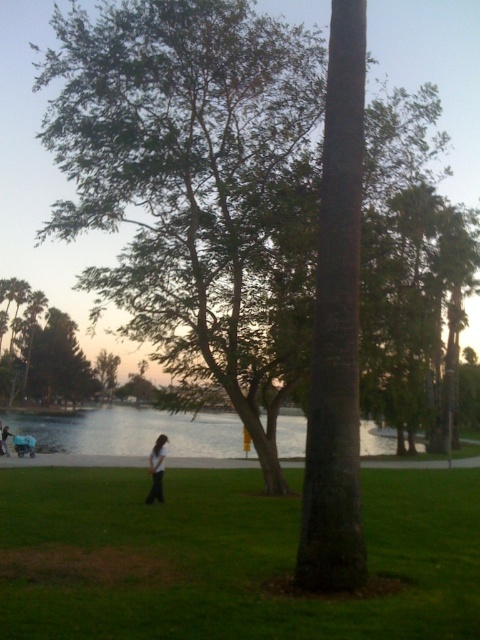
Question: Can you confirm if green grass at center is positioned to the left of dark blue jeans at center?

Choices:
 (A) yes
 (B) no

Answer: (B)

Question: Which is nearer to the clear water at center?

Choices:
 (A) dark blue jeans at center
 (B) light brown hair at center

Answer: (B)

Question: Which point is closer to the camera taking this photo?

Choices:
 (A) (286, 449)
 (B) (4, 449)
 (C) (147, 499)

Answer: (C)

Question: Is green grass at center thinner than clear water at center?

Choices:
 (A) yes
 (B) no

Answer: (A)

Question: Is green grass at center smaller than light brown hair at center?

Choices:
 (A) no
 (B) yes

Answer: (B)

Question: Which of these objects is positioned farthest from the light brown hair at center?

Choices:
 (A) dark blue jeans at center
 (B) clear water at center

Answer: (A)